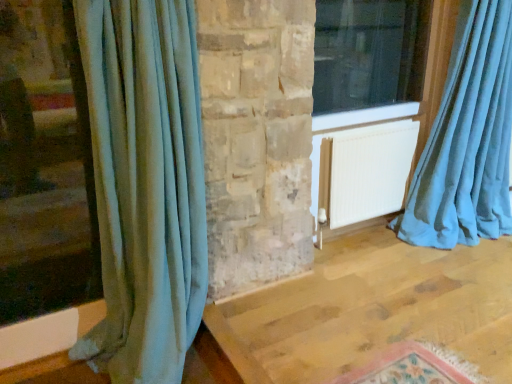
Question: From a real-world perspective, is velvet teal curtain at left, the first curtain from the left, physically located above or below teal velvet curtain at right, the first curtain when ordered from right to left?

Choices:
 (A) below
 (B) above

Answer: (A)

Question: Based on their sizes in the image, would you say velvet teal curtain at left, the first curtain from the left, is bigger or smaller than teal velvet curtain at right, acting as the second curtain starting from the left?

Choices:
 (A) small
 (B) big

Answer: (A)

Question: Which is farther from the white matte radiator at center?

Choices:
 (A) velvet teal curtain at left, which ranks as the second curtain in right-to-left order
 (B) transparent glass window at upper right
 (C) teal velvet curtain at right, the first curtain when ordered from right to left

Answer: (A)

Question: Based on their relative distances, which object is farther from the white matte radiator at center?

Choices:
 (A) transparent glass window at upper right
 (B) teal velvet curtain at right, the first curtain when ordered from right to left
 (C) velvet teal curtain at left, which ranks as the second curtain in right-to-left order

Answer: (C)